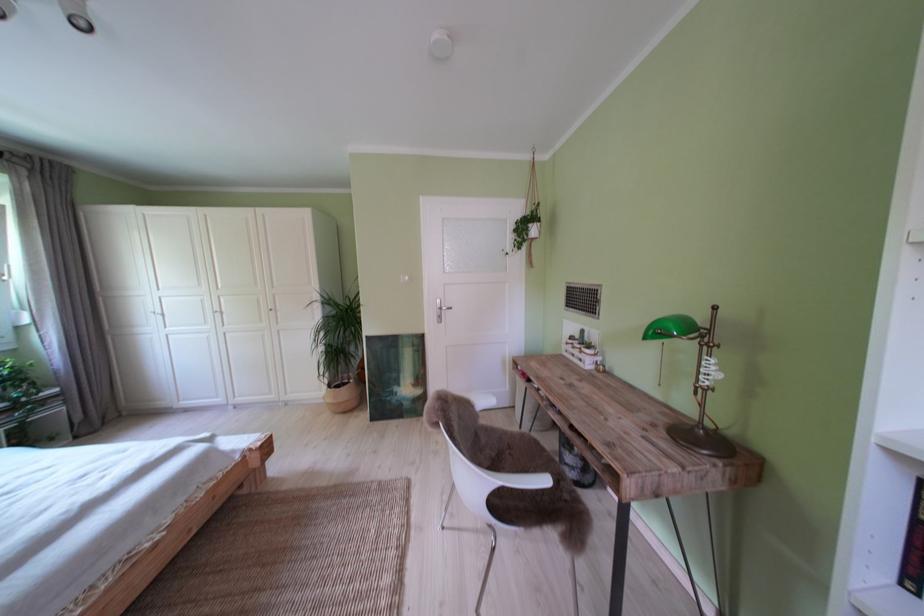
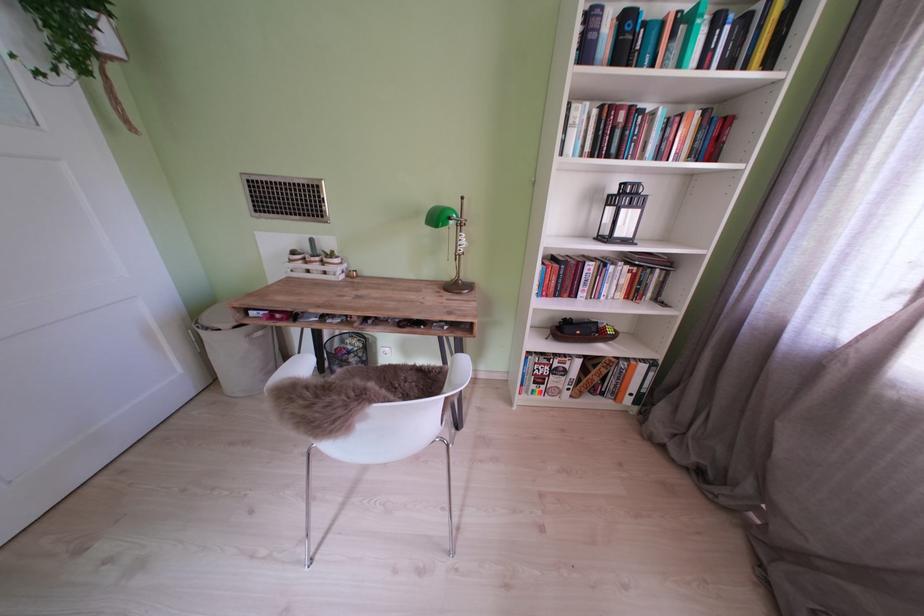
From the picture: How did the camera likely rotate?

The rotation direction of the camera is right-down.